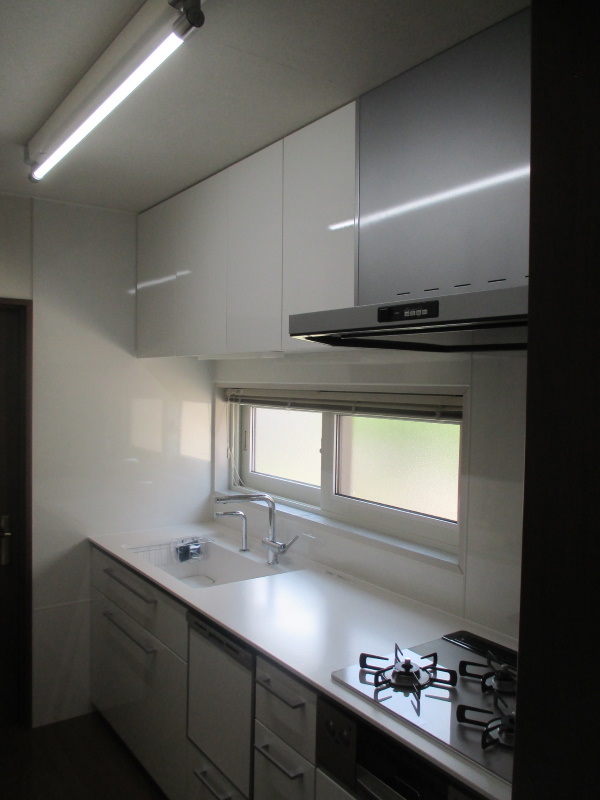
I want to click on rangehood, so click(x=485, y=302).